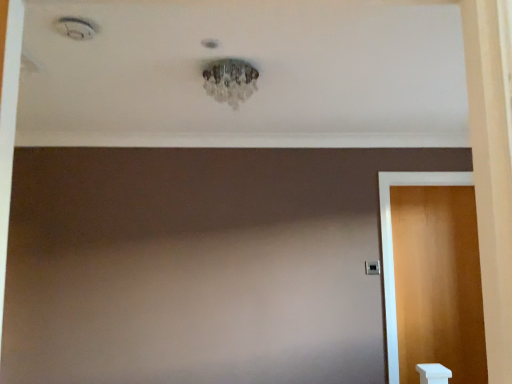
Question: Does wooden door at right have a lesser width compared to black plastic door handle at right?

Choices:
 (A) no
 (B) yes

Answer: (A)

Question: Is black plastic door handle at right a part of wooden door at right?

Choices:
 (A) no
 (B) yes

Answer: (A)

Question: From the image's perspective, is wooden door at right located above black plastic door handle at right?

Choices:
 (A) no
 (B) yes

Answer: (A)

Question: From the image's perspective, is wooden door at right under black plastic door handle at right?

Choices:
 (A) no
 (B) yes

Answer: (B)

Question: Is wooden door at right at the left side of black plastic door handle at right?

Choices:
 (A) yes
 (B) no

Answer: (B)

Question: Is wooden door at right positioned with its back to black plastic door handle at right?

Choices:
 (A) no
 (B) yes

Answer: (A)

Question: Considering the relative sizes of black plastic door handle at right and wooden door at right in the image provided, is black plastic door handle at right bigger than wooden door at right?

Choices:
 (A) yes
 (B) no

Answer: (B)

Question: Would you say wooden door at right is part of black plastic door handle at right's contents?

Choices:
 (A) yes
 (B) no

Answer: (B)

Question: Is the position of black plastic door handle at right less distant than that of wooden door at right?

Choices:
 (A) no
 (B) yes

Answer: (A)

Question: Does black plastic door handle at right have a lesser height compared to wooden door at right?

Choices:
 (A) yes
 (B) no

Answer: (A)

Question: From a real-world perspective, is black plastic door handle at right positioned over wooden door at right based on gravity?

Choices:
 (A) no
 (B) yes

Answer: (B)

Question: From the image's perspective, is black plastic door handle at right under wooden door at right?

Choices:
 (A) no
 (B) yes

Answer: (A)

Question: In terms of height, does black plastic door handle at right look taller or shorter compared to wooden door at right?

Choices:
 (A) tall
 (B) short

Answer: (B)